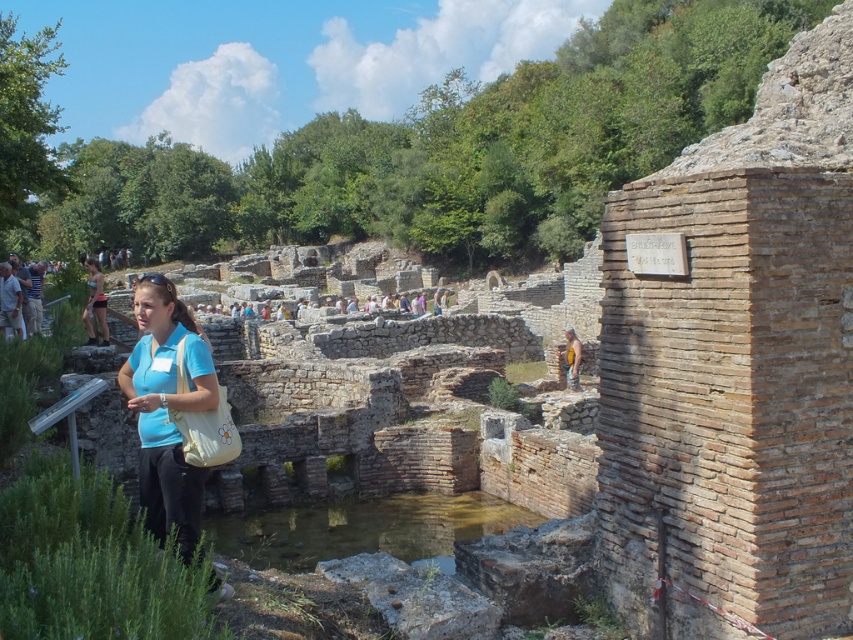
Question: Can you confirm if clear stone water at center is positioned to the left of matte black shorts at center?

Choices:
 (A) yes
 (B) no

Answer: (B)

Question: Which of the following is the farthest from the observer?

Choices:
 (A) (189, 321)
 (B) (93, 275)

Answer: (B)

Question: In this image, where is matte blue shirt at center located relative to matte black shorts at center?

Choices:
 (A) left
 (B) right

Answer: (B)

Question: Which point is farther to the camera?

Choices:
 (A) matte blue shirt at center
 (B) clear stone water at center

Answer: (B)

Question: Considering the real-world distances, which object is farthest from the matte blue shirt at center?

Choices:
 (A) matte black shorts at center
 (B) clear stone water at center

Answer: (A)

Question: Can you confirm if matte blue shirt at center is smaller than matte black shorts at center?

Choices:
 (A) yes
 (B) no

Answer: (A)